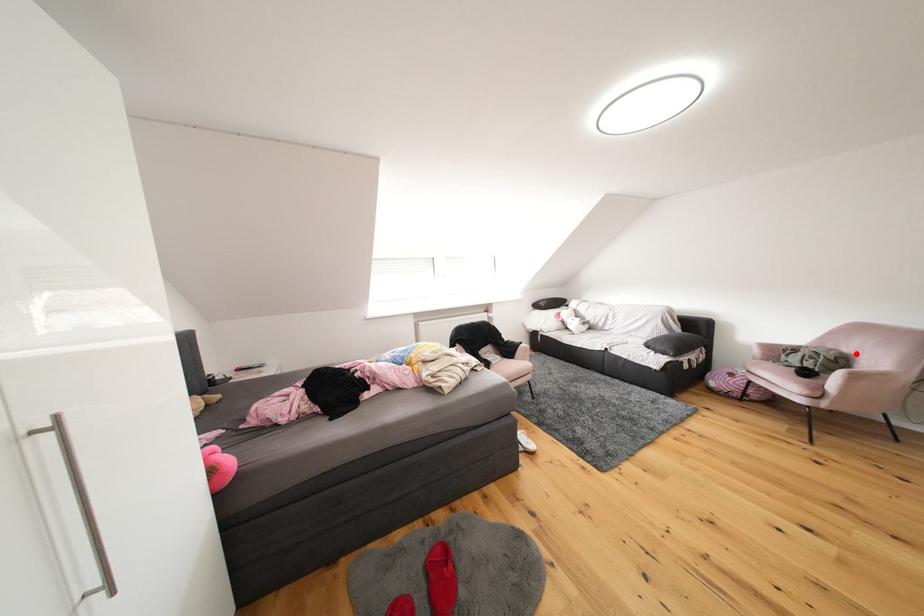
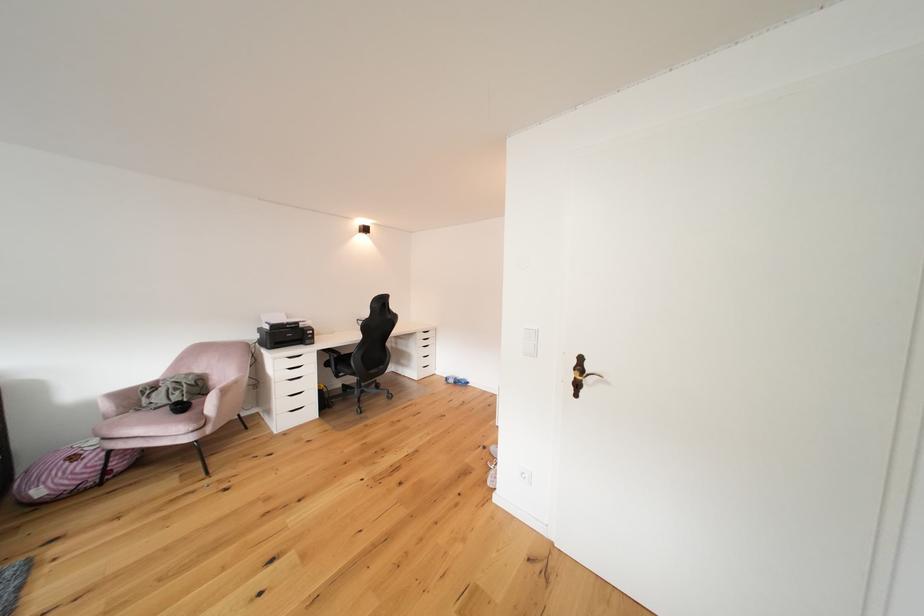
Find the pixel in the second image that matches the highlighted location in the first image.

(208, 374)